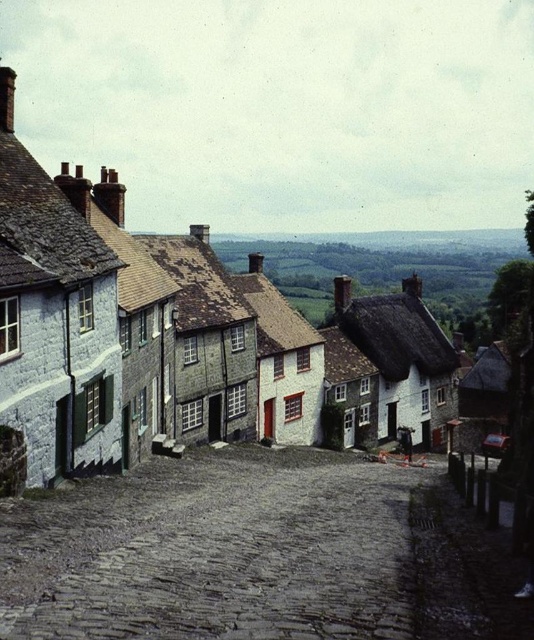
Question: Does gray cobblestone alley at center appear on the right side of white stone houses at center?

Choices:
 (A) no
 (B) yes

Answer: (B)

Question: Which object is farther from the camera taking this photo?

Choices:
 (A) white stone houses at center
 (B) gray cobblestone alley at center

Answer: (A)

Question: Can you confirm if gray cobblestone alley at center is wider than white stone houses at center?

Choices:
 (A) yes
 (B) no

Answer: (B)

Question: Is gray cobblestone alley at center smaller than white stone houses at center?

Choices:
 (A) no
 (B) yes

Answer: (B)

Question: Which of the following is the closest to the observer?

Choices:
 (A) click(465, 595)
 (B) click(68, 467)

Answer: (A)